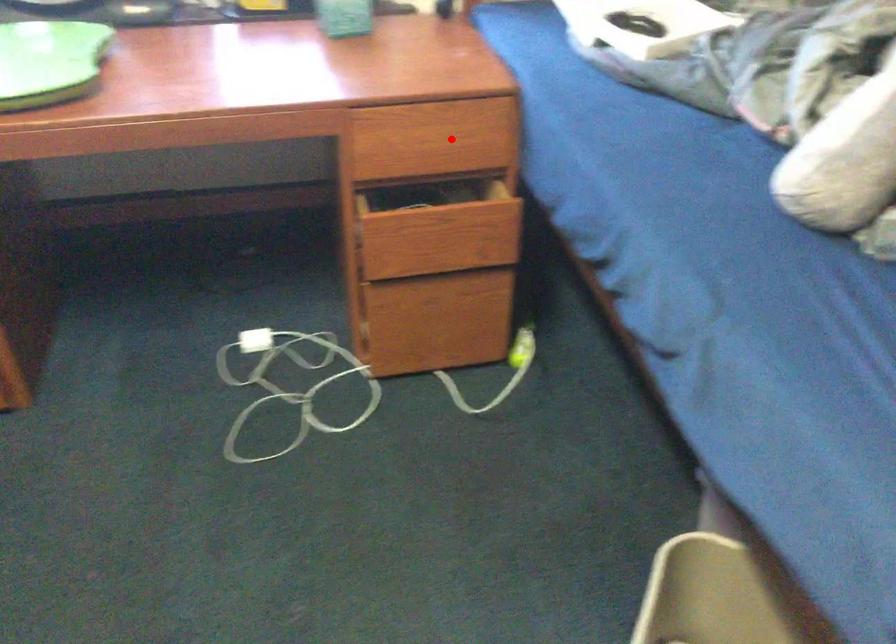
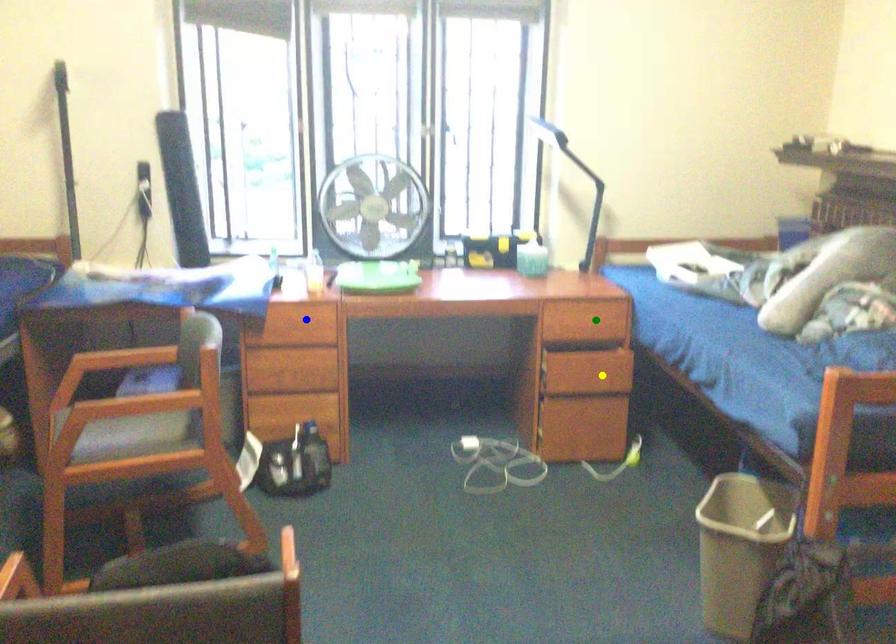
Question: I am providing you with two images of the same scene from different viewpoints. A red point is marked on the first image. You are given multiple points on the second image. Which spot in image 2 lines up with the point in image 1?

Choices:
 (A) yellow point
 (B) green point
 (C) blue point

Answer: (B)